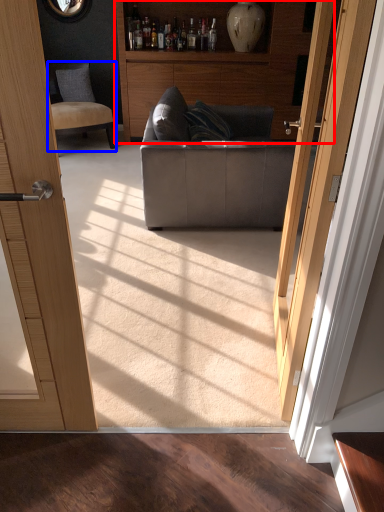
Question: Which of the following is the farthest to the observer, cabinetry (highlighted by a red box) or chair (highlighted by a blue box)?

Choices:
 (A) cabinetry
 (B) chair

Answer: (A)